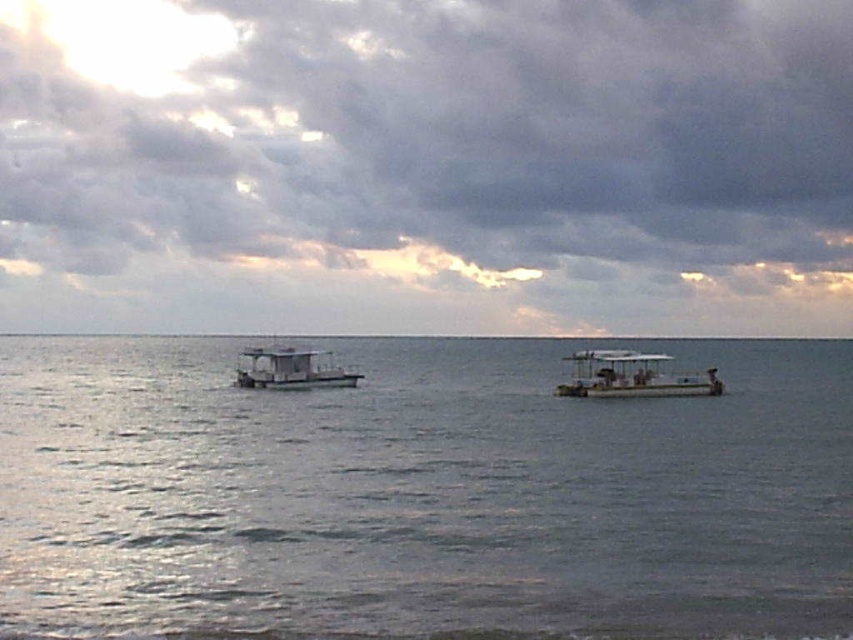
Which is above, cloudy sky at upper center or white matte boat at center?

Positioned higher is cloudy sky at upper center.

Which is below, cloudy sky at upper center or white matte boat at center?

Positioned lower is white matte boat at center.

Looking at this image, who is more forward, (x=569, y=68) or (x=236, y=371)?

Point (x=236, y=371)

Identify the location of cloudy sky at upper center. Image resolution: width=853 pixels, height=640 pixels. (426, 164).

Is clear water at center thinner than metallic gray boat at right?

No.

Does clear water at center appear over metallic gray boat at right?

No.

Is point (85, 483) more distant than point (578, 369)?

No, (85, 483) is in front of (578, 369).

Where is `clear water at center`? clear water at center is located at coordinates (421, 493).

Can you confirm if cloudy sky at upper center is positioned to the right of clear water at center?

No, cloudy sky at upper center is not to the right of clear water at center.

Who is lower down, cloudy sky at upper center or clear water at center?

clear water at center is below.

Identify the location of cloudy sky at upper center. (426, 164).